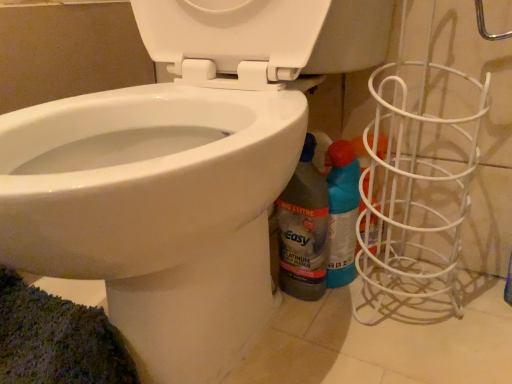
Question: Is blue glossy spray can at lower right, marked as the second cleaning product in a left-to-right arrangement, positioned with its back to white glossy bidet at lower left?

Choices:
 (A) no
 (B) yes

Answer: (B)

Question: Is blue glossy spray can at lower right, marked as the second cleaning product in a left-to-right arrangement, shorter than white glossy bidet at lower left?

Choices:
 (A) no
 (B) yes

Answer: (B)

Question: Does blue glossy spray can at lower right, which appears as the 1th cleaning product when viewed from the right, have a greater width compared to white glossy bidet at lower left?

Choices:
 (A) no
 (B) yes

Answer: (A)

Question: From the image's perspective, is blue glossy spray can at lower right, which appears as the 1th cleaning product when viewed from the right, over white glossy bidet at lower left?

Choices:
 (A) no
 (B) yes

Answer: (A)

Question: From a real-world perspective, is blue glossy spray can at lower right, which appears as the 1th cleaning product when viewed from the right, physically below white glossy bidet at lower left?

Choices:
 (A) no
 (B) yes

Answer: (B)

Question: Looking at their shapes, would you say translucent plastic bottle at lower right, the first cleaning product in the left-to-right sequence, is wider or thinner than white glossy bidet at lower left?

Choices:
 (A) thin
 (B) wide

Answer: (A)

Question: Is translucent plastic bottle at lower right, the first cleaning product in the left-to-right sequence, bigger or smaller than white glossy bidet at lower left?

Choices:
 (A) big
 (B) small

Answer: (B)

Question: Considering their positions, is translucent plastic bottle at lower right, the second cleaning product in the right-to-left sequence, located in front of or behind white glossy bidet at lower left?

Choices:
 (A) behind
 (B) front

Answer: (A)

Question: In terms of height, does translucent plastic bottle at lower right, the second cleaning product in the right-to-left sequence, look taller or shorter compared to white glossy bidet at lower left?

Choices:
 (A) tall
 (B) short

Answer: (B)

Question: From the image's perspective, is blue glossy spray can at lower right, which appears as the 1th cleaning product when viewed from the right, positioned above or below translucent plastic bottle at lower right, the second cleaning product in the right-to-left sequence?

Choices:
 (A) above
 (B) below

Answer: (B)

Question: Is point (327, 173) positioned closer to the camera than point (326, 220)?

Choices:
 (A) farther
 (B) closer

Answer: (A)

Question: From a real-world perspective, is blue glossy spray can at lower right, marked as the second cleaning product in a left-to-right arrangement, positioned above or below translucent plastic bottle at lower right, the second cleaning product in the right-to-left sequence?

Choices:
 (A) below
 (B) above

Answer: (A)

Question: In terms of width, does blue glossy spray can at lower right, which appears as the 1th cleaning product when viewed from the right, look wider or thinner when compared to translucent plastic bottle at lower right, the second cleaning product in the right-to-left sequence?

Choices:
 (A) wide
 (B) thin

Answer: (A)

Question: From a real-world perspective, relative to translucent plastic bottle at lower right, the first cleaning product in the left-to-right sequence, is white glossy bidet at lower left vertically above or below?

Choices:
 (A) below
 (B) above

Answer: (B)

Question: Considering the positions of point (18, 132) and point (305, 157), is point (18, 132) closer or farther from the camera than point (305, 157)?

Choices:
 (A) farther
 (B) closer

Answer: (B)